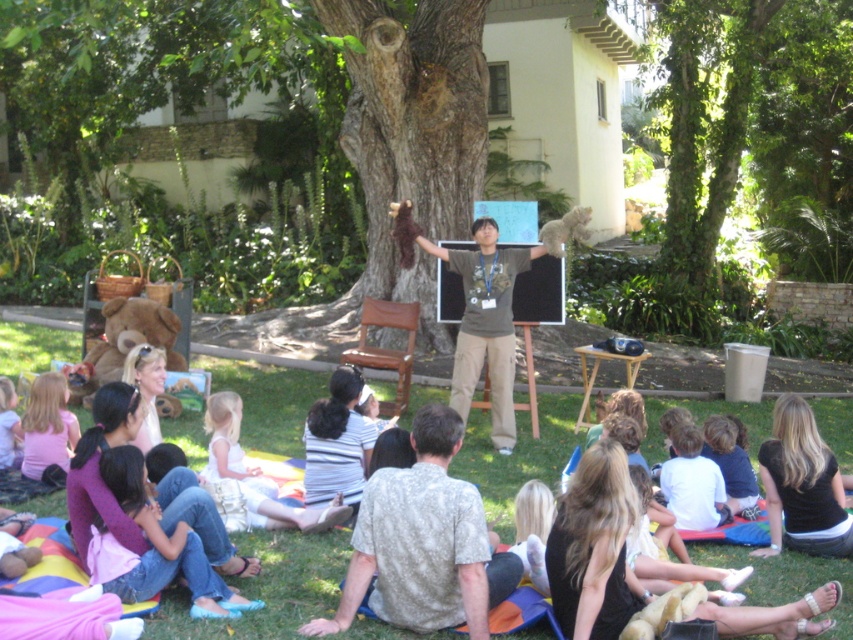
You are a photographer positioned at the edge of the garden. You want to capture a photo of the white cotton dress at center from your current position. Is the dress visible in your frame without any obstructions?

The white cotton dress at center is located at point [250,477], which means it is positioned within the frame and not obstructed, so yes, it should be visible in the photo.

Looking at this image, you are a photographer positioned behind the group of people sitting on the colorful blankets. You want to capture a photo that includes both the brown rough tree at center and the white cotton dress at center. Which object should you adjust your camera focus to first to ensure it is in sharp focus?

The brown rough tree at center is further to the viewer than the white cotton dress at center, so you should focus on the brown rough tree at center first to ensure proper depth of field.